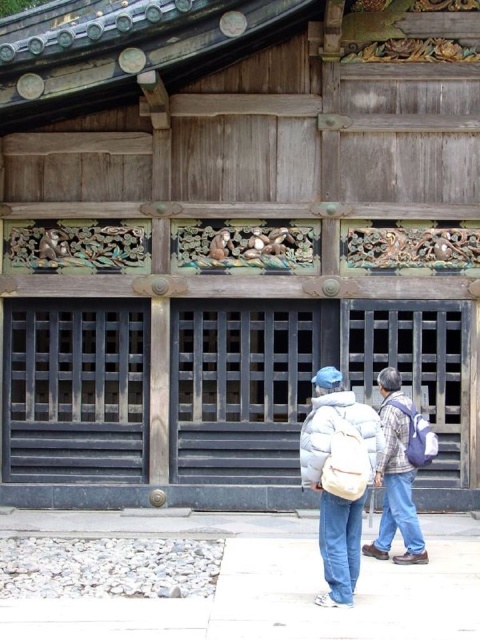
Which is more to the right, white matte jacket at center or light blue denim jeans at center?

Positioned to the right is light blue denim jeans at center.

Measure the distance between point (356, 486) and camera.

They are 9.06 meters apart.

This screenshot has height=640, width=480. I want to click on white matte jacket at center, so click(338, 476).

I want to click on white matte jacket at center, so click(338, 476).

Does white matte jacket at center have a greater width compared to blue fabric backpack at right?

Indeed, white matte jacket at center has a greater width compared to blue fabric backpack at right.

Which is behind, point (336, 589) or point (436, 444)?

The point (436, 444) is more distant.

Is point (314, 413) closer to viewer compared to point (384, 404)?

Yes.

Locate an element on the screen. This screenshot has height=640, width=480. white matte jacket at center is located at coordinates (338, 476).

Who is higher up, light blue denim jeans at center or blue fabric backpack at right?

blue fabric backpack at right

Does light blue denim jeans at center appear under blue fabric backpack at right?

Indeed, light blue denim jeans at center is positioned under blue fabric backpack at right.

Is point (381, 483) farther from viewer compared to point (418, 448)?

No, it is not.

You are a GUI agent. You are given a task and a screenshot of the screen. Output one action in this format:
    pyautogui.click(x=<x>, y=<y>)
    Task: Click on the light blue denim jeans at center
    The width and height of the screenshot is (480, 640).
    Given the screenshot: What is the action you would take?
    pyautogui.click(x=396, y=476)